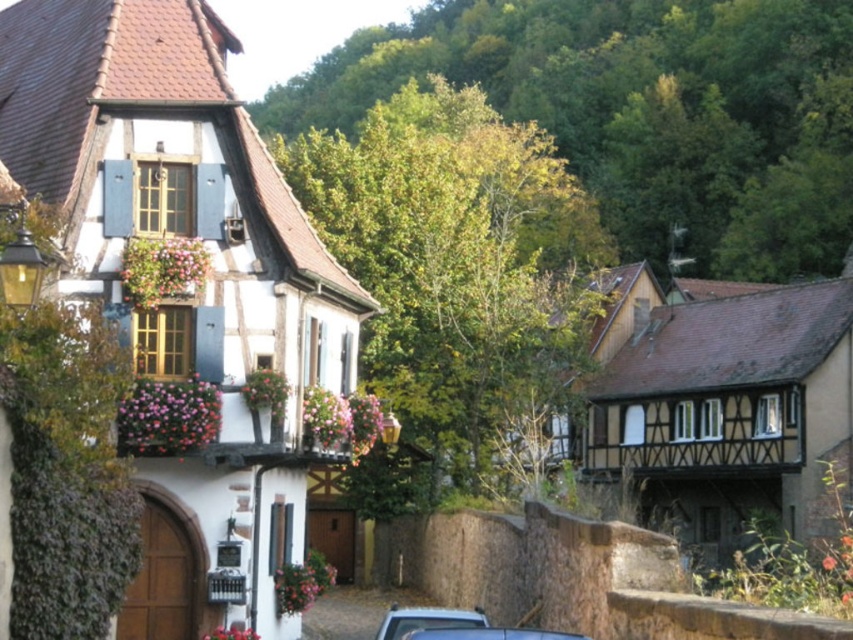
Question: Does white wood house at left have a larger size compared to metallic silver car at lower center?

Choices:
 (A) no
 (B) yes

Answer: (B)

Question: Is white wood house at left smaller than metallic silver car at lower center?

Choices:
 (A) yes
 (B) no

Answer: (B)

Question: Among these points, which one is farthest from the camera?

Choices:
 (A) (503, 628)
 (B) (71, 131)

Answer: (B)

Question: Among these points, which one is nearest to the camera?

Choices:
 (A) (x=442, y=625)
 (B) (x=135, y=344)

Answer: (A)

Question: Does white wood house at left have a smaller size compared to metallic silver car at lower center?

Choices:
 (A) yes
 (B) no

Answer: (B)